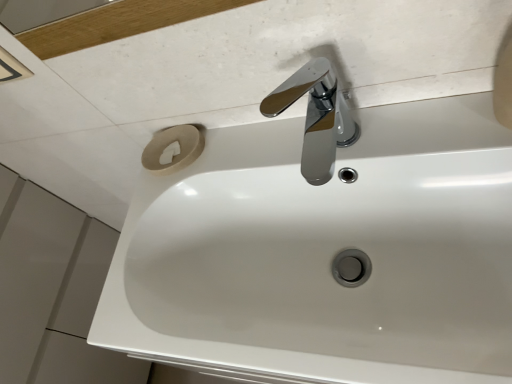
The image size is (512, 384). Describe the element at coordinates (326, 253) in the screenshot. I see `white glossy sink at center` at that location.

Where is `white glossy sink at center`? This screenshot has height=384, width=512. white glossy sink at center is located at coordinates (326, 253).

The image size is (512, 384). Find the location of `chrome/metallic faucet at upper center`. chrome/metallic faucet at upper center is located at coordinates (317, 117).

What is the approximate height of chrome/metallic faucet at upper center?

The height of chrome/metallic faucet at upper center is 5.56 inches.

This screenshot has width=512, height=384. Describe the element at coordinates (317, 117) in the screenshot. I see `chrome/metallic faucet at upper center` at that location.

At what (x,y) coordinates should I click in order to perform the action: click on white glossy sink at center. Please return your answer as a coordinate pair (x, y). Image resolution: width=512 pixels, height=384 pixels. Looking at the image, I should click on [x=326, y=253].

Is chrome/metallic faucet at upper center to the left of white glossy sink at center from the viewer's perspective?

No.

Is the position of chrome/metallic faucet at upper center more distant than that of white glossy sink at center?

Yes.

Is point (329, 73) positioned behind point (499, 219)?

Yes, point (329, 73) is behind point (499, 219).

From the image's perspective, is chrome/metallic faucet at upper center on top of white glossy sink at center?

Yes, from the image's perspective, chrome/metallic faucet at upper center is on top of white glossy sink at center.

From a real-world perspective, relative to white glossy sink at center, is chrome/metallic faucet at upper center vertically above or below?

Clearly, from a real-world perspective, chrome/metallic faucet at upper center is above white glossy sink at center.

Looking at their sizes, would you say chrome/metallic faucet at upper center is wider or thinner than white glossy sink at center?

Considering their sizes, chrome/metallic faucet at upper center looks slimmer than white glossy sink at center.

Considering the sizes of objects chrome/metallic faucet at upper center and white glossy sink at center in the image provided, who is taller, chrome/metallic faucet at upper center or white glossy sink at center?

chrome/metallic faucet at upper center.

Which of these two, chrome/metallic faucet at upper center or white glossy sink at center, is bigger?

white glossy sink at center.

Would you say chrome/metallic faucet at upper center contains white glossy sink at center?

That's incorrect, white glossy sink at center is not inside chrome/metallic faucet at upper center.

Is chrome/metallic faucet at upper center beside white glossy sink at center?

No, chrome/metallic faucet at upper center is not making contact with white glossy sink at center.

Is chrome/metallic faucet at upper center facing away from white glossy sink at center?

No.

This screenshot has width=512, height=384. Identify the location of tap that is behind the white glossy sink at center. (317, 117).

Based on their positions, is white glossy sink at center located to the left or right of chrome/metallic faucet at upper center?

white glossy sink at center is to the left of chrome/metallic faucet at upper center.

Which object is further away from the camera, white glossy sink at center or chrome/metallic faucet at upper center?

chrome/metallic faucet at upper center is further away from the camera.

Which is farther, (289, 336) or (281, 90)?

The point (281, 90) is more distant.

From the image's perspective, does white glossy sink at center appear lower than chrome/metallic faucet at upper center?

Yes.

From a real-world perspective, who is located lower, white glossy sink at center or chrome/metallic faucet at upper center?

white glossy sink at center, from a real-world perspective.

Is white glossy sink at center wider than chrome/metallic faucet at upper center?

Correct, the width of white glossy sink at center exceeds that of chrome/metallic faucet at upper center.

Who is shorter, white glossy sink at center or chrome/metallic faucet at upper center?

With less height is white glossy sink at center.

Which of these two, white glossy sink at center or chrome/metallic faucet at upper center, is smaller?

With smaller size is chrome/metallic faucet at upper center.

Does white glossy sink at center contain chrome/metallic faucet at upper center?

No, chrome/metallic faucet at upper center is not inside white glossy sink at center.

Is white glossy sink at center beside chrome/metallic faucet at upper center?

There is a gap between white glossy sink at center and chrome/metallic faucet at upper center.

Is white glossy sink at center looking in the opposite direction of chrome/metallic faucet at upper center?

No, chrome/metallic faucet at upper center is not at the back of white glossy sink at center.

How different are the orientations of white glossy sink at center and chrome/metallic faucet at upper center in degrees?

The angular difference between white glossy sink at center and chrome/metallic faucet at upper center is 1.83e-05 degrees.

This screenshot has width=512, height=384. There is a white glossy sink at center. In order to click on tap above it (from a real-world perspective) in this screenshot , I will do `click(317, 117)`.

Identify the location of sink to the left of chrome/metallic faucet at upper center. (326, 253).

I want to click on tap above the white glossy sink at center (from a real-world perspective), so click(x=317, y=117).